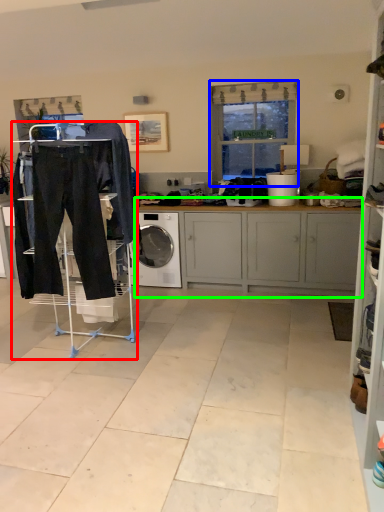
Question: Based on their relative distances, which object is farther from shelf (highlighted by a red box)? Choose from window (highlighted by a blue box) and cabinetry (highlighted by a green box).

Choices:
 (A) window
 (B) cabinetry

Answer: (A)